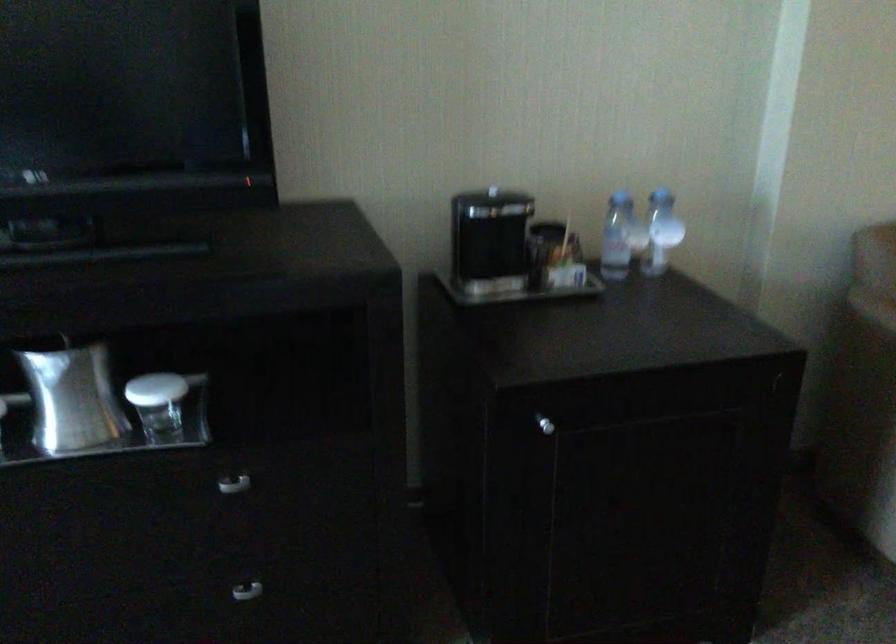
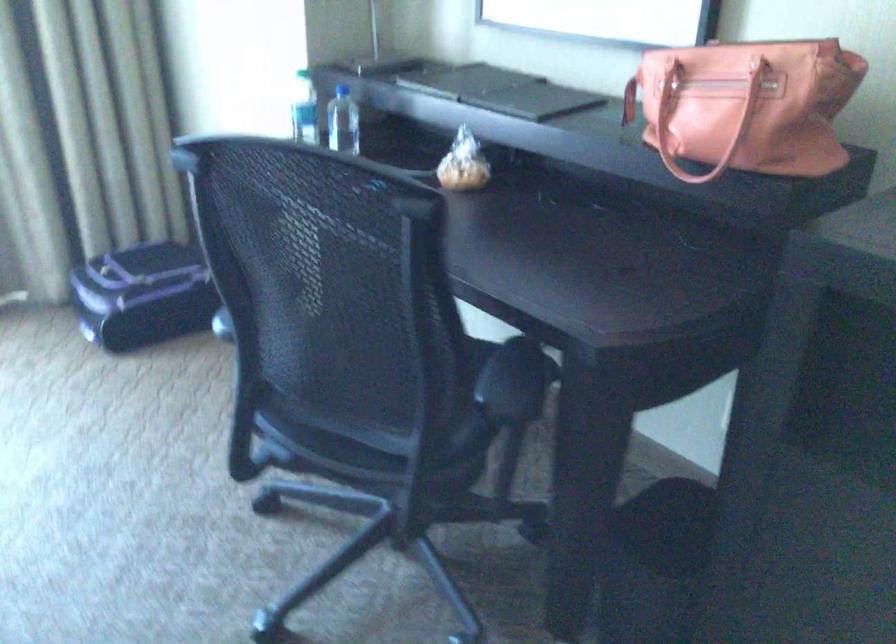
Question: How did the camera likely rotate?

Choices:
 (A) Left
 (B) Right
 (C) Up
 (D) Down

Answer: (A)